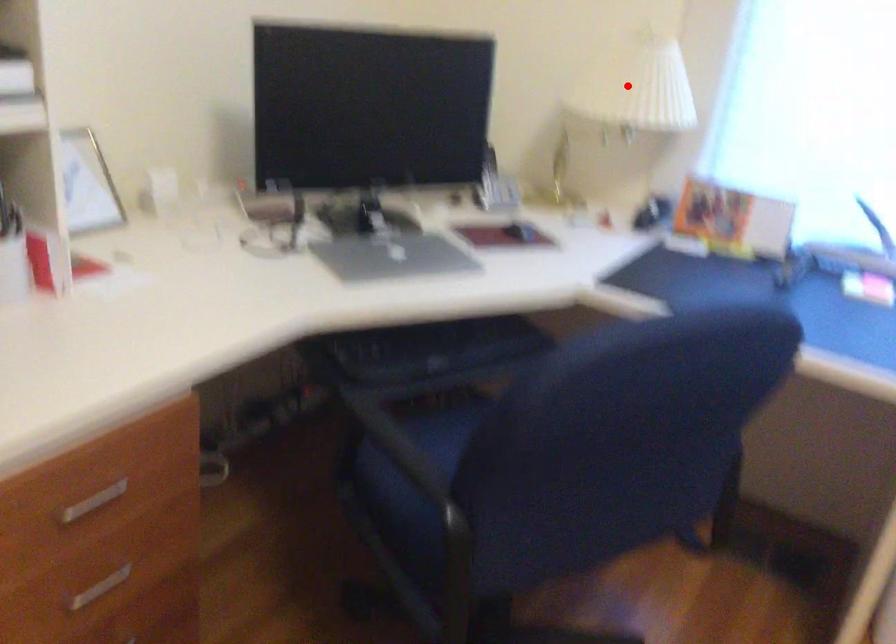
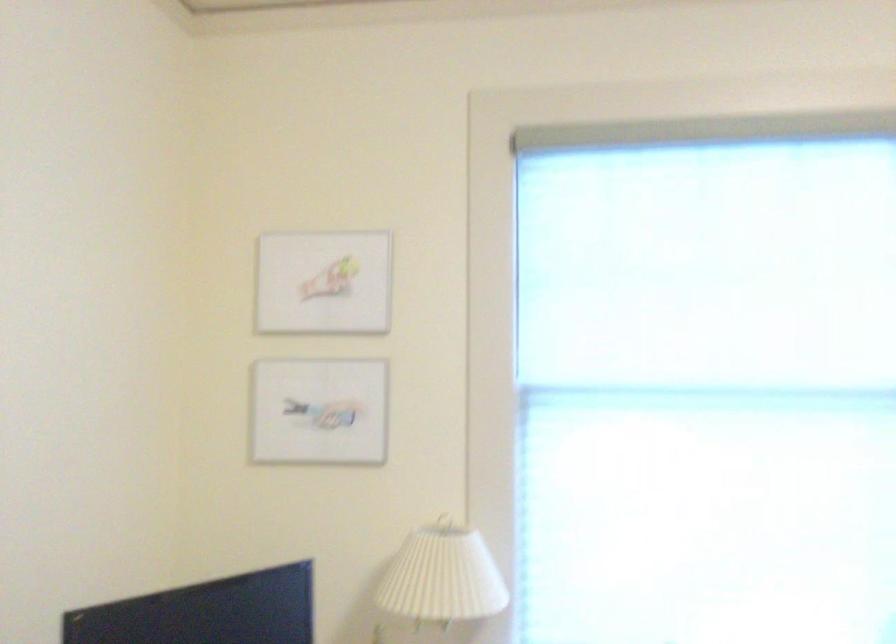
In the second image, find the point that corresponds to the highlighted location in the first image.

(443, 576)